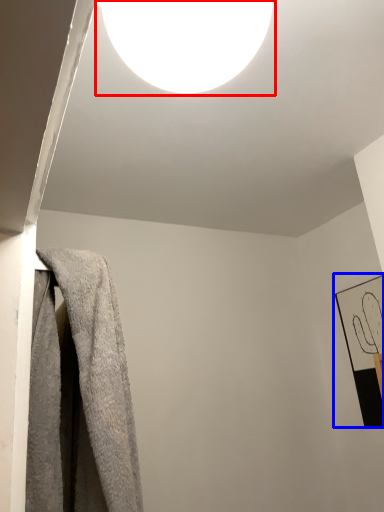
Question: Which of the following is the farthest to the observer, lamp (highlighted by a red box) or picture frame (highlighted by a blue box)?

Choices:
 (A) lamp
 (B) picture frame

Answer: (B)